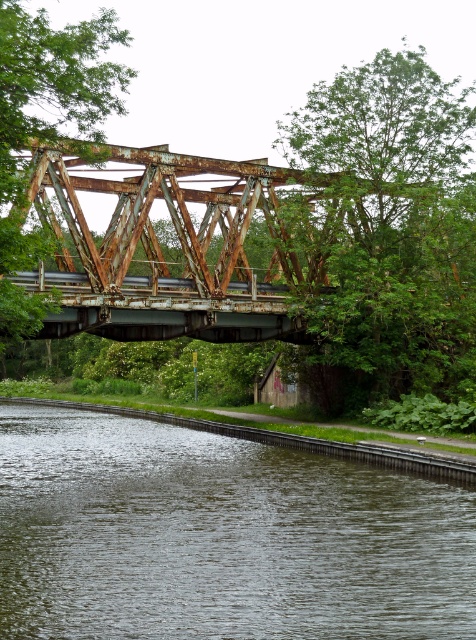
Question: Is green leafy tree at upper right smaller than rusty metal bridge at center?

Choices:
 (A) yes
 (B) no

Answer: (B)

Question: From the image, what is the correct spatial relationship of dark green water at lower left in relation to rusty metal bridge at center?

Choices:
 (A) above
 (B) below

Answer: (B)

Question: Which of the following is the farthest from the observer?

Choices:
 (A) rusty metal bridge at center
 (B) rusty metal train bridge at center
 (C) dark green water at lower left

Answer: (B)

Question: Which point is farther to the camera?

Choices:
 (A) (417, 376)
 (B) (387, 508)
 (C) (287, 272)
 (D) (17, 225)

Answer: (C)

Question: Is dark green water at lower left positioned before rusty metal train bridge at center?

Choices:
 (A) yes
 (B) no

Answer: (A)

Question: Which of the following is the closest to the observer?

Choices:
 (A) green leafy tree at upper right
 (B) rusty metal bridge at center

Answer: (B)